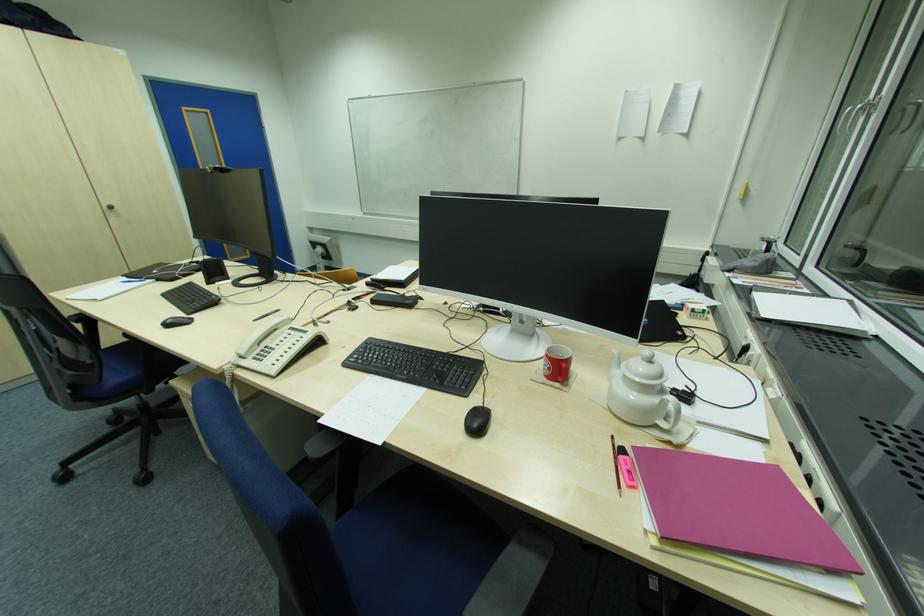
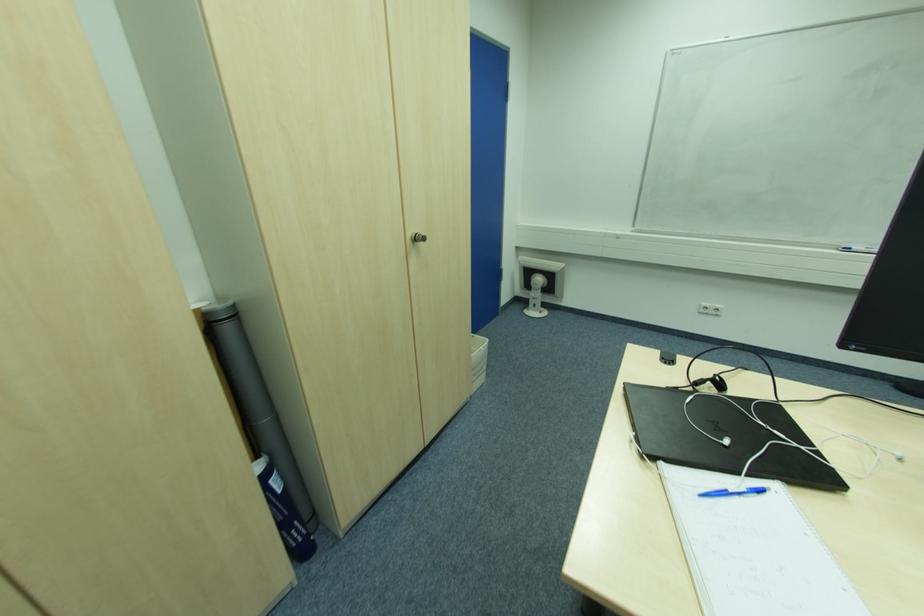
Find the pixel in the second image that matches (321,264) in the first image.

(536, 300)